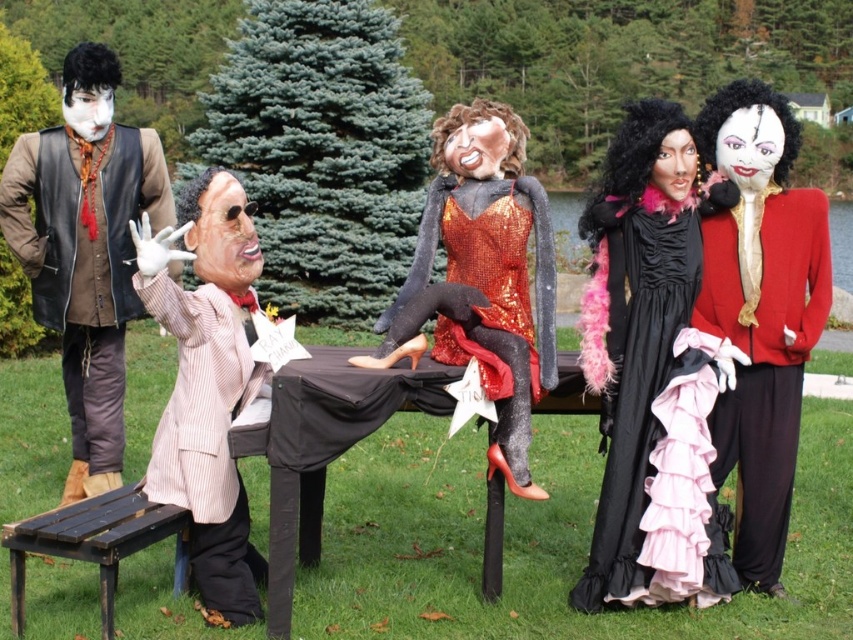
Who is lower down, leather vest at left or shiny sequined dress at center?

shiny sequined dress at center is below.

Describe the element at coordinates (86, 250) in the screenshot. I see `leather vest at left` at that location.

The image size is (853, 640). What are the coordinates of `leather vest at left` in the screenshot? It's located at (86, 250).

Find the location of `pink striped suit at center`. pink striped suit at center is located at coordinates (206, 440).

Is pink striped suit at center wider than wooden park bench at lower left?

No.

The image size is (853, 640). In order to click on pink striped suit at center in this screenshot , I will do `click(206, 440)`.

Between leather vest at left and wooden park bench at lower left, which one has less height?

Standing shorter between the two is wooden park bench at lower left.

Which is behind, point (27, 208) or point (30, 516)?

The point (27, 208) is behind.

Is point (113, 428) more distant than point (108, 637)?

Yes, it is behind point (108, 637).

The width and height of the screenshot is (853, 640). Identify the location of leather vest at left. (86, 250).